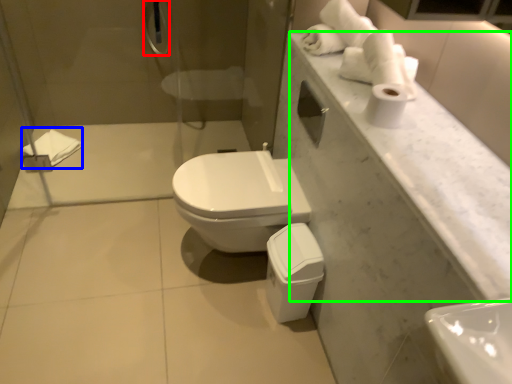
Question: Estimate the real-world distances between objects in this image. Which object is farther from shower (highlighted by a red box), bath towel (highlighted by a blue box) or counter top (highlighted by a green box)?

Choices:
 (A) bath towel
 (B) counter top

Answer: (B)